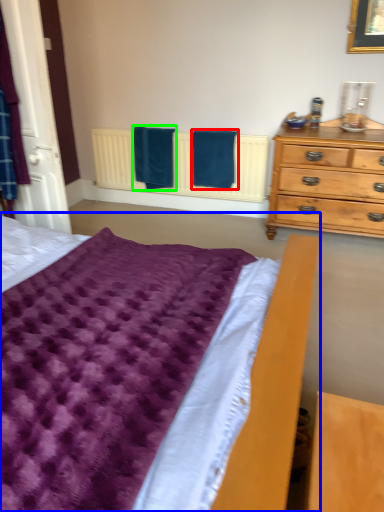
Question: Considering the real-world distances, which object is closest to bath towel (highlighted by a red box)? bed (highlighted by a blue box) or bath towel (highlighted by a green box).

Choices:
 (A) bed
 (B) bath towel

Answer: (B)